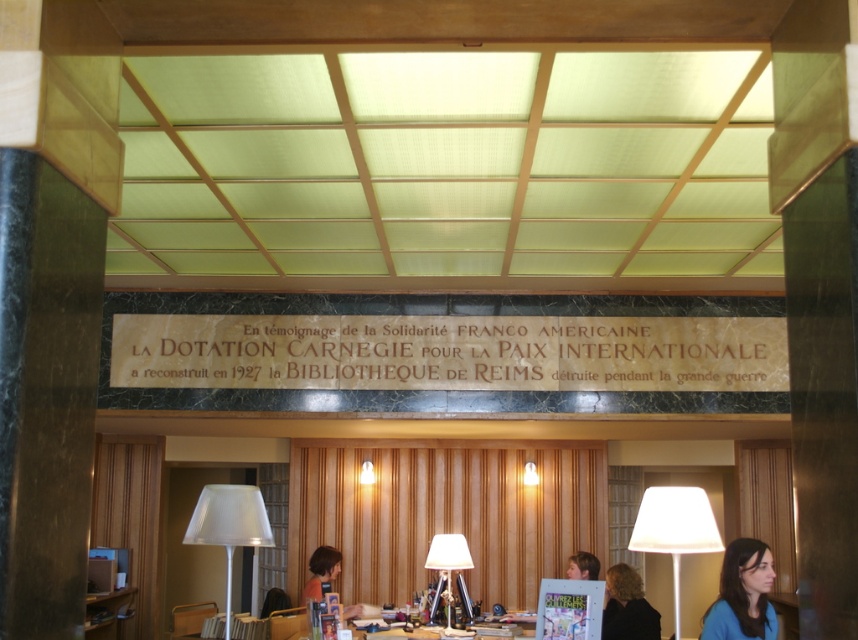
You are standing in the library and want to locate the blue matte shirt at lower right. According to the coordinates given, where would you look to find it?

Answer: The blue matte shirt at lower right is located at coordinates point (742, 595), which is near the bottom right corner of the image.

You are an interior designer planning to hang a new artwork between the white fabric lampshade at right and the blue matte shirt at lower right. Based on their current positions, which object should the artwork be placed closer to in order to maintain symmetry?

The artwork should be placed closer to the blue matte shirt at lower right because the white fabric lampshade at right is positioned under the blue matte shirt at lower right, meaning the shirt is higher up, so to maintain symmetry, the artwork should balance their vertical positions by aligning closer to the lower object.